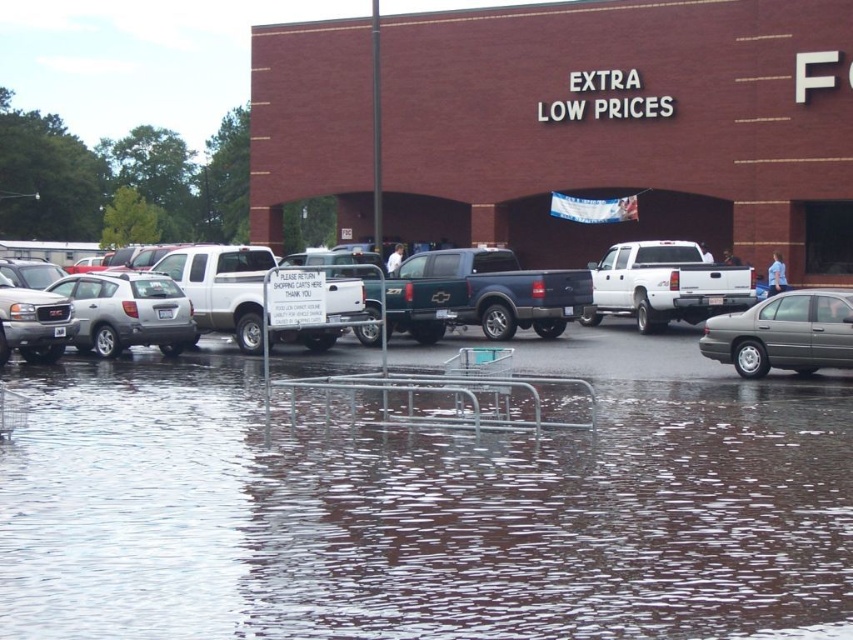
Which is behind, point (747, 285) or point (167, 321)?

Point (747, 285)

Which is in front, point (697, 292) or point (97, 348)?

Positioned in front is point (97, 348).

Does point (741, 292) lie in front of point (141, 288)?

No, it is behind (141, 288).

Find the location of a particular element. The height and width of the screenshot is (640, 853). white matte truck at center is located at coordinates (665, 284).

Which is below, white matte truck at center or metallic gray sedan at right?

metallic gray sedan at right is lower down.

Who is more forward, [622,243] or [816,289]?

Point [816,289] is in front.

I want to click on white matte truck at center, so click(x=665, y=284).

How far apart are metallic gray sedan at right and satin silver suv at left?

metallic gray sedan at right is 10.73 meters away from satin silver suv at left.

Is the position of metallic gray sedan at right less distant than that of satin silver suv at left?

Yes, metallic gray sedan at right is in front of satin silver suv at left.

This screenshot has width=853, height=640. What do you see at coordinates (784, 333) in the screenshot?
I see `metallic gray sedan at right` at bounding box center [784, 333].

The height and width of the screenshot is (640, 853). In order to click on metallic gray sedan at right in this screenshot , I will do `click(784, 333)`.